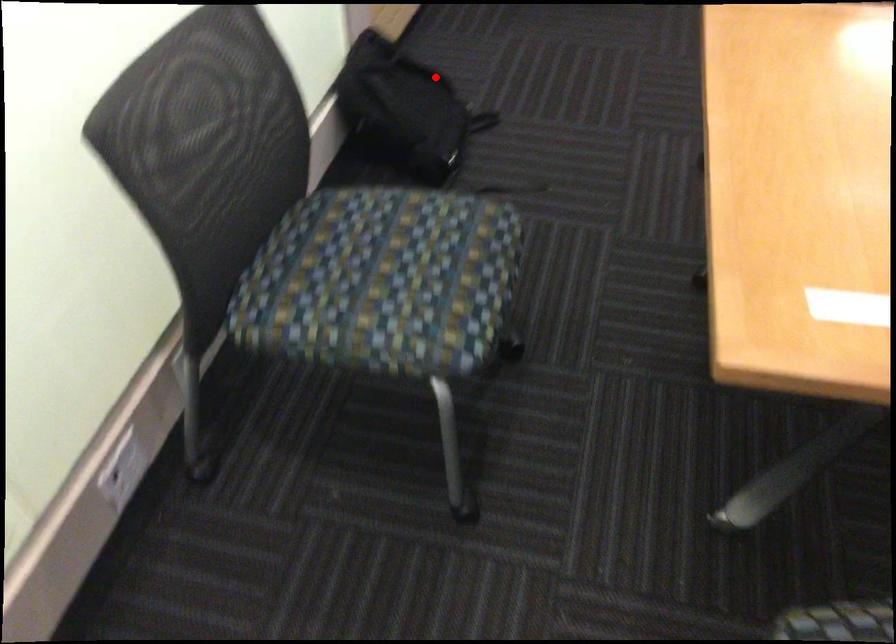
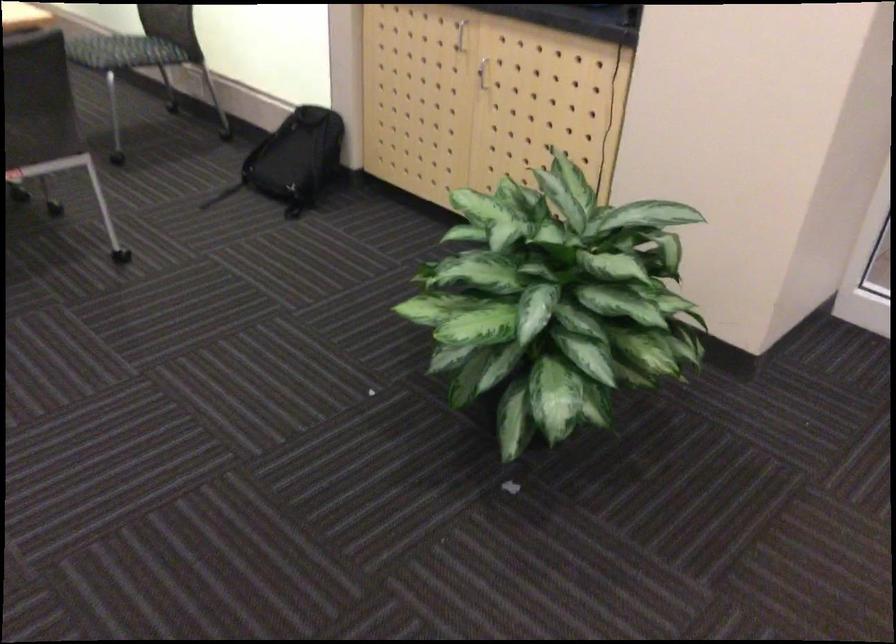
Question: A red point is marked in image1. In image2, is the corresponding 3D point closer to the camera or farther? Reply with the corresponding letter.

Choices:
 (A) The corresponding 3D point is closer.
 (B) The corresponding 3D point is farther.

Answer: (B)